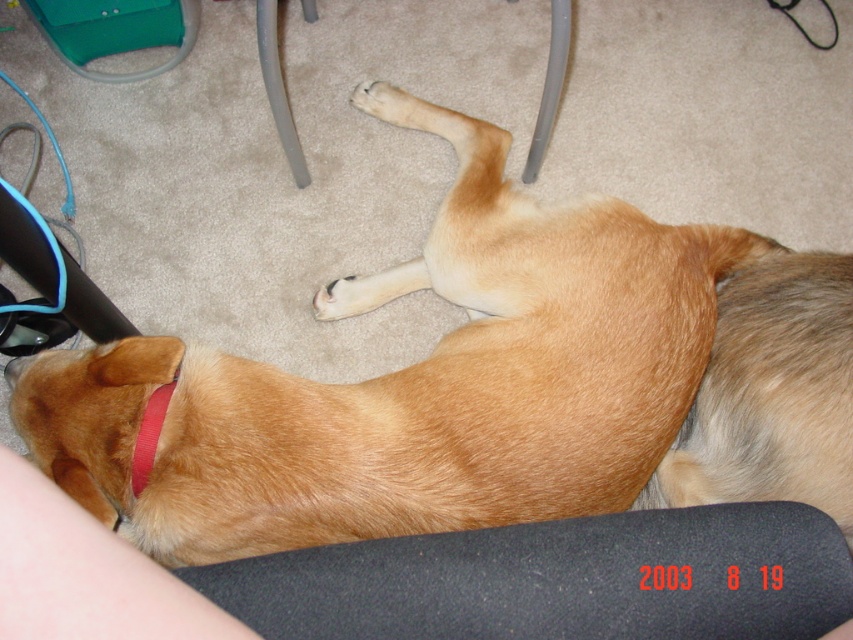
Question: Estimate the real-world distances between objects in this image. Which object is farther from the black matte mouse pad at lower center?

Choices:
 (A) golden fur dog at lower center
 (B) red fabric neckband at lower left
 (C) fuzzy fur at center

Answer: (C)

Question: From the image, what is the correct spatial relationship of golden fur dog at lower center in relation to fuzzy fur at center?

Choices:
 (A) below
 (B) above

Answer: (B)

Question: Is golden fur dog at lower center thinner than fuzzy fur at center?

Choices:
 (A) yes
 (B) no

Answer: (B)

Question: Which object appears farthest from the camera in this image?

Choices:
 (A) fuzzy fur at center
 (B) black matte mouse pad at lower center
 (C) red fabric neckband at lower left
 (D) golden fur dog at lower center

Answer: (A)

Question: Which point appears closest to the camera in this image?

Choices:
 (A) (732, 243)
 (B) (463, 582)

Answer: (B)

Question: Is golden fur dog at lower center to the left of red fabric neckband at lower left from the viewer's perspective?

Choices:
 (A) yes
 (B) no

Answer: (B)